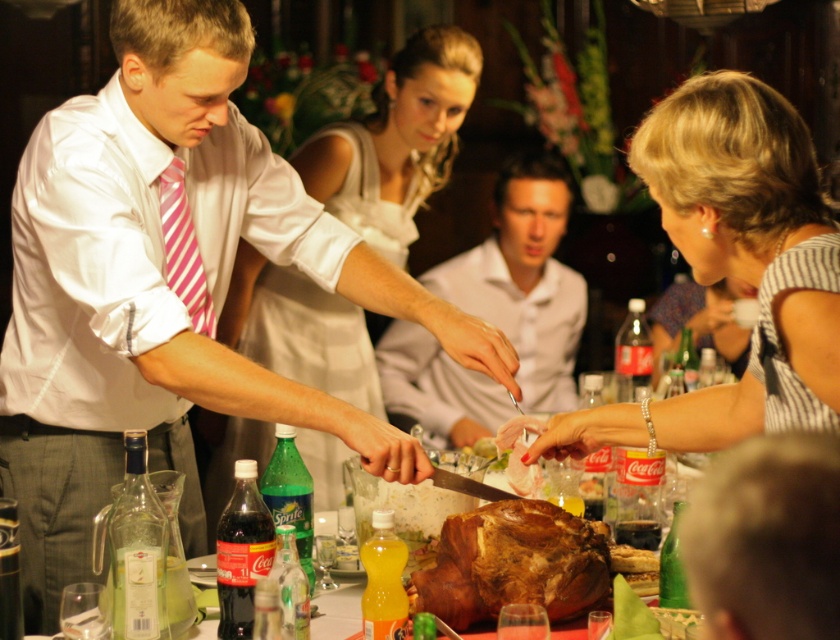
Image resolution: width=840 pixels, height=640 pixels. What do you see at coordinates (168, 288) in the screenshot?
I see `white satin shirt at center` at bounding box center [168, 288].

Does white satin shirt at center appear on the left side of translucent orange juice at center?

Yes, white satin shirt at center is to the left of translucent orange juice at center.

Where is `white satin shirt at center`? The image size is (840, 640). white satin shirt at center is located at coordinates (168, 288).

This screenshot has width=840, height=640. Identify the location of white satin shirt at center. (168, 288).

Is dark red plastic coca-cola bottle at lower left bigger than brown crispy bread at center?

Yes.

Is dark red plastic coca-cola bottle at lower left wider than brown crispy bread at center?

Correct, the width of dark red plastic coca-cola bottle at lower left exceeds that of brown crispy bread at center.

Describe the element at coordinates (240, 552) in the screenshot. I see `dark red plastic coca-cola bottle at lower left` at that location.

What are the coordinates of `dark red plastic coca-cola bottle at lower left` in the screenshot? It's located at (240, 552).

Which of these two, translucent orange juice at center or brown crispy bread at center, stands taller?

translucent orange juice at center

Between translucent orange juice at center and brown crispy bread at center, which one appears on the right side from the viewer's perspective?

brown crispy bread at center is more to the right.

Is point (386, 634) in front of point (620, 560)?

Yes, point (386, 634) is in front of point (620, 560).

You are a GUI agent. You are given a task and a screenshot of the screen. Output one action in this format:
    pyautogui.click(x=<x>, y=<y>)
    Task: Click on the translucent orange juice at center
    The width and height of the screenshot is (840, 640).
    Given the screenshot: What is the action you would take?
    pyautogui.click(x=382, y=586)